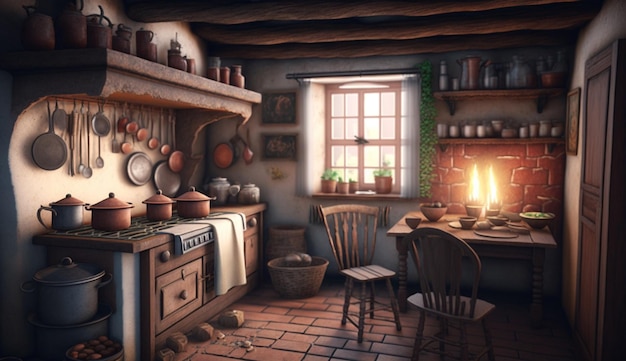
The width and height of the screenshot is (626, 361). Identify the location of table. (525, 247).